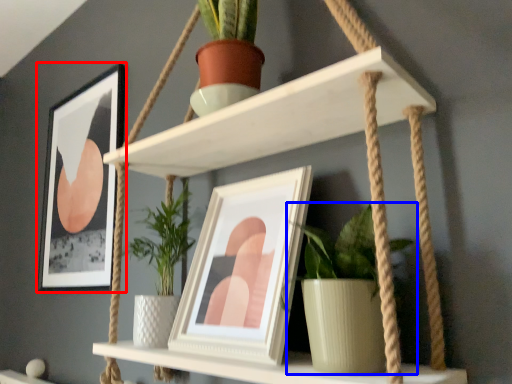
Question: Which point is further to the camera, picture frame (highlighted by a red box) or houseplant (highlighted by a blue box)?

Choices:
 (A) picture frame
 (B) houseplant

Answer: (A)